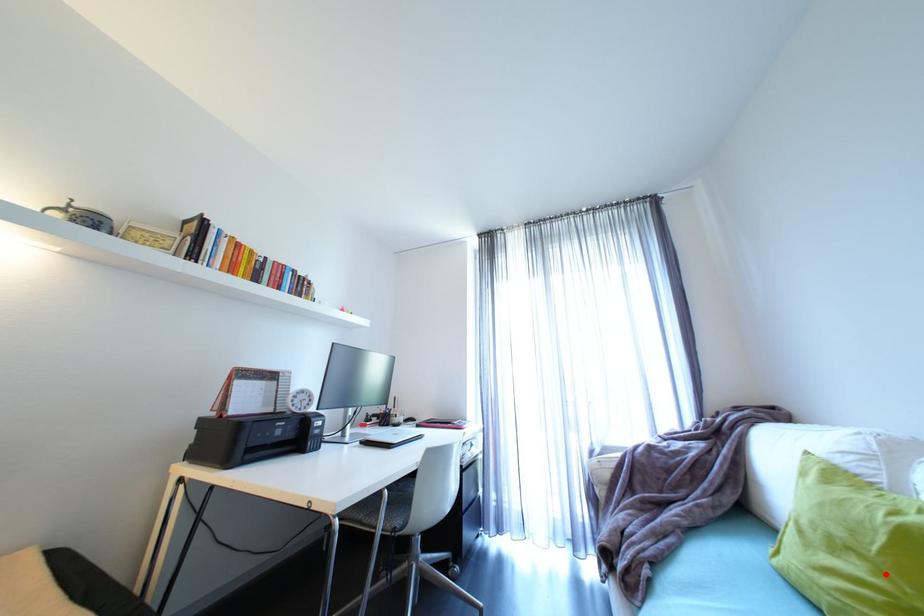
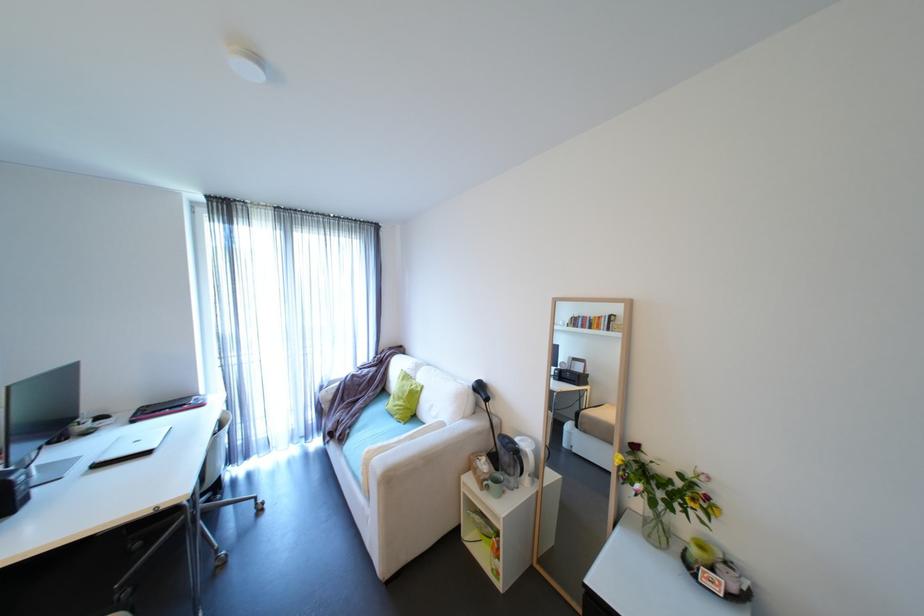
Question: I am providing you with two images of the same scene from different viewpoints. Image1 has a red point marked. In image2, the corresponding 3D location appears at what relative position? Reply with the corresponding letter.

Choices:
 (A) Closer
 (B) Farther

Answer: (B)